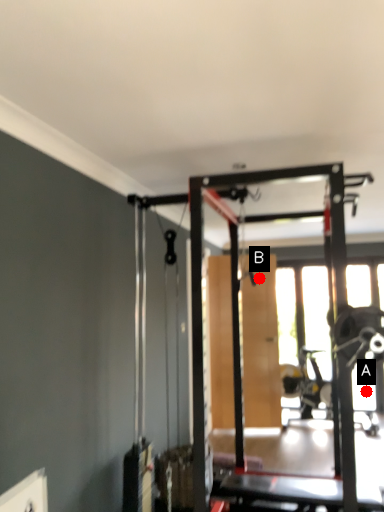
Question: Two points are circled on the image, labeled by A and B beside each circle. Which point is closer to the camera?

Choices:
 (A) A is closer
 (B) B is closer

Answer: (B)